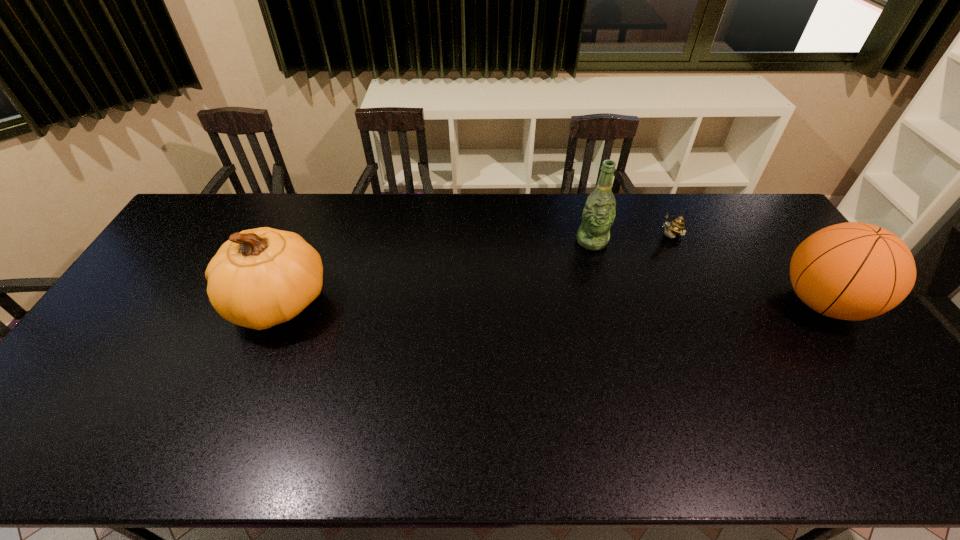
At what (x,y) coordinates should I click in order to perform the action: click on blank space located on the surface of the third object from right to left. Please return your answer as a coordinate pair (x, y). Looking at the image, I should click on (606, 290).

Locate an element on the screen. The height and width of the screenshot is (540, 960). free space located 0.180m on the surface of the third object from right to left is located at coordinates (607, 292).

You are a GUI agent. You are given a task and a screenshot of the screen. Output one action in this format:
    pyautogui.click(x=<x>, y=<y>)
    Task: Click on the vacant area situated 0.190m on the face of the snail
    Image resolution: width=960 pixels, height=540 pixels.
    Given the screenshot: What is the action you would take?
    click(x=619, y=263)

Where is `vacant space located 0.210m on the face of the snail`? Image resolution: width=960 pixels, height=540 pixels. vacant space located 0.210m on the face of the snail is located at coordinates (614, 265).

I want to click on vacant space situated 0.380m on the face of the snail, so click(576, 287).

Locate an element on the screen. The width and height of the screenshot is (960, 540). beer bottle that is at the far edge is located at coordinates (598, 215).

You are a GUI agent. You are given a task and a screenshot of the screen. Output one action in this format:
    pyautogui.click(x=<x>, y=<y>)
    Task: Click on the snail that is at the far edge
    Image resolution: width=960 pixels, height=540 pixels.
    Given the screenshot: What is the action you would take?
    pyautogui.click(x=676, y=227)

The height and width of the screenshot is (540, 960). I want to click on object that is at the right edge, so click(x=853, y=271).

Where is `free space at the far edge of the desktop`? Image resolution: width=960 pixels, height=540 pixels. free space at the far edge of the desktop is located at coordinates (439, 204).

In the image, there is a desktop. Identify the location of vacant space at the near edge. (718, 392).